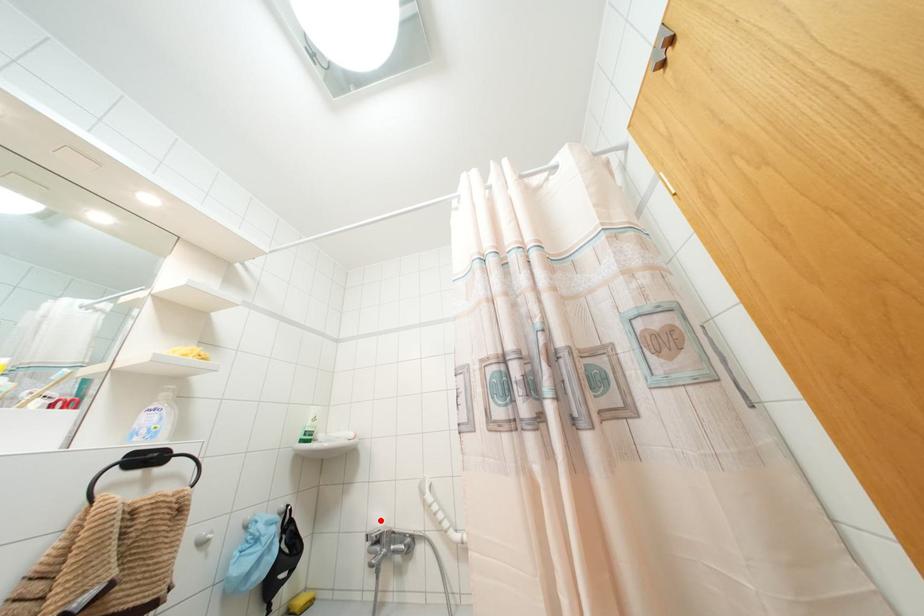
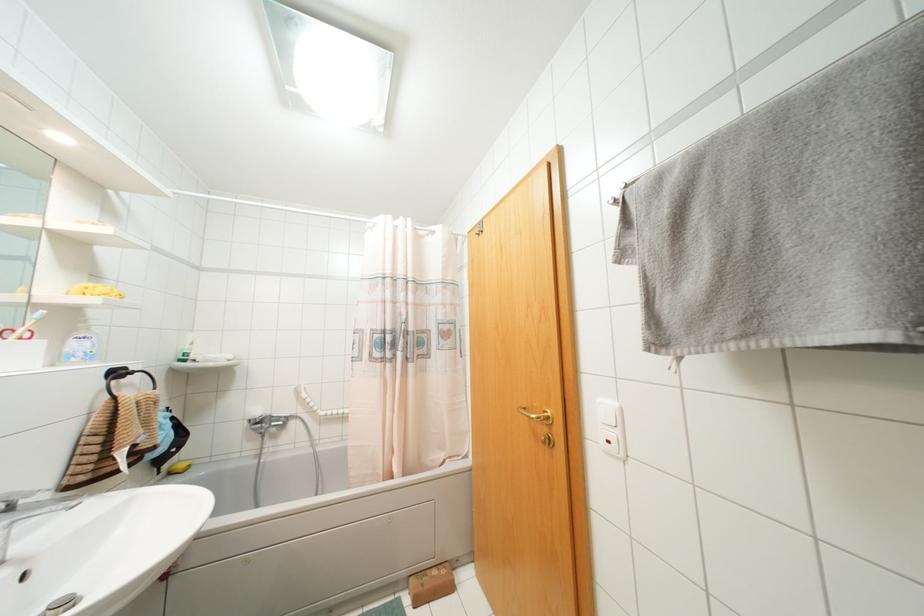
Find the pixel in the second image that matches the highlighted location in the first image.

(258, 411)